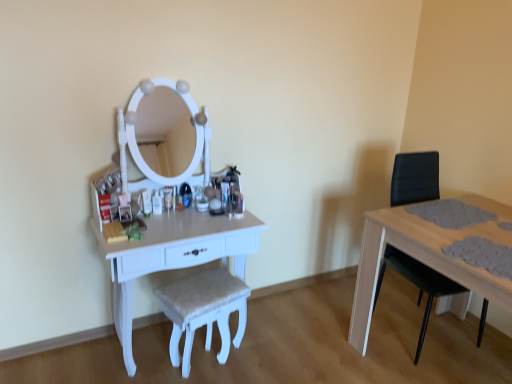
Where is `blank space to the left of white textured stool at center`? The image size is (512, 384). blank space to the left of white textured stool at center is located at coordinates (146, 361).